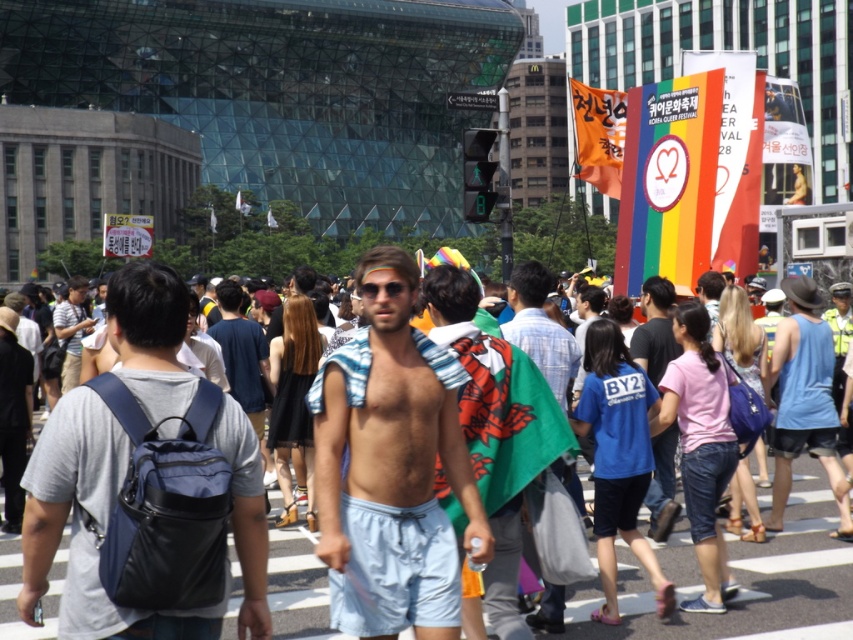
Question: From the image, what is the correct spatial relationship of gray fabric backpack at center in relation to blue fabric tank top at center-right?

Choices:
 (A) above
 (B) below

Answer: (A)

Question: Is green fabric cape at center wider than matte black shirt at left?

Choices:
 (A) no
 (B) yes

Answer: (A)

Question: Among these objects, which one is farthest from the camera?

Choices:
 (A) green fabric cape at center
 (B) matte black shirt at left
 (C) green fabric flag at center

Answer: (B)

Question: Which point is closer to the camera?

Choices:
 (A) blue cotton shirt at center
 (B) green fabric flag at center
 (C) green fabric cape at center

Answer: (C)

Question: Is green fabric flag at center thinner than blue cotton shirt at center?

Choices:
 (A) yes
 (B) no

Answer: (A)

Question: Based on their relative distances, which object is nearer to the green fabric flag at center?

Choices:
 (A) light blue cotton shorts at center
 (B) light brown hair at center
 (C) blue cotton shirt at center
 (D) green fabric cape at center

Answer: (A)